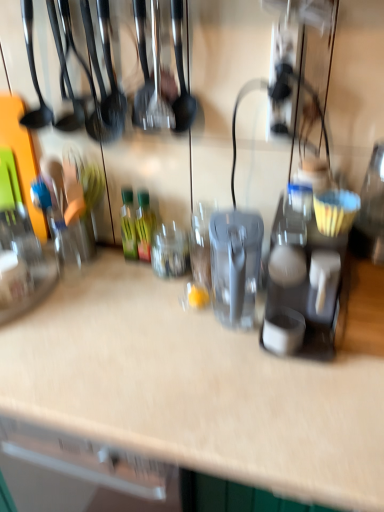
Question: Considering the relative sizes of matte gray coffee maker at center right and green glass bottle at center, the 2th bottle viewed from the left, in the image provided, is matte gray coffee maker at center right taller than green glass bottle at center, the 2th bottle viewed from the left,?

Choices:
 (A) no
 (B) yes

Answer: (B)

Question: Considering the relative sizes of matte gray coffee maker at center right and green glass bottle at center, the 2th bottle viewed from the left, in the image provided, is matte gray coffee maker at center right wider than green glass bottle at center, the 2th bottle viewed from the left,?

Choices:
 (A) no
 (B) yes

Answer: (B)

Question: Would you consider matte gray coffee maker at center right to be distant from green glass bottle at center, the 2th bottle viewed from the left?

Choices:
 (A) yes
 (B) no

Answer: (B)

Question: Is matte gray coffee maker at center right positioned with its back to green glass bottle at center, which ranks as the first bottle in right-to-left order?

Choices:
 (A) no
 (B) yes

Answer: (A)

Question: Is matte gray coffee maker at center right positioned in front of green glass bottle at center, which ranks as the first bottle in right-to-left order?

Choices:
 (A) no
 (B) yes

Answer: (B)

Question: Considering the positions of green glass bottle at center, the 2th bottle viewed from the left, and matte gray coffee maker at center right in the image, is green glass bottle at center, the 2th bottle viewed from the left, taller or shorter than matte gray coffee maker at center right?

Choices:
 (A) tall
 (B) short

Answer: (B)

Question: From a real-world perspective, is green glass bottle at center, which ranks as the first bottle in right-to-left order, above or below matte gray coffee maker at center right?

Choices:
 (A) above
 (B) below

Answer: (B)

Question: In the image, is green glass bottle at center, the 2th bottle viewed from the left, positioned in front of or behind matte gray coffee maker at center right?

Choices:
 (A) behind
 (B) front

Answer: (A)

Question: Which is correct: green glass bottle at center, the 2th bottle viewed from the left, is inside matte gray coffee maker at center right, or outside of it?

Choices:
 (A) inside
 (B) outside

Answer: (B)

Question: Which is correct: matte gray coffee maker at center right is inside green glass bottle at center, the 2th bottle viewed from the left, or outside of it?

Choices:
 (A) outside
 (B) inside

Answer: (A)

Question: From the image's perspective, relative to green glass bottle at center, the 2th bottle viewed from the left, is matte gray coffee maker at center right above or below?

Choices:
 (A) below
 (B) above

Answer: (A)

Question: Is matte gray coffee maker at center right in front of or behind green glass bottle at center, the 2th bottle viewed from the left, in the image?

Choices:
 (A) behind
 (B) front

Answer: (B)

Question: Considering the positions of matte gray coffee maker at center right and green glass bottle at center, the 2th bottle viewed from the left, in the image, is matte gray coffee maker at center right taller or shorter than green glass bottle at center, the 2th bottle viewed from the left,?

Choices:
 (A) short
 (B) tall

Answer: (B)

Question: Does point (148, 247) appear closer or farther from the camera than point (122, 240)?

Choices:
 (A) farther
 (B) closer

Answer: (B)

Question: Looking at the image, does green glass bottle at center, the 2th bottle viewed from the left, seem bigger or smaller compared to green glass bottle at center, the 2th bottle when ordered from right to left?

Choices:
 (A) small
 (B) big

Answer: (B)